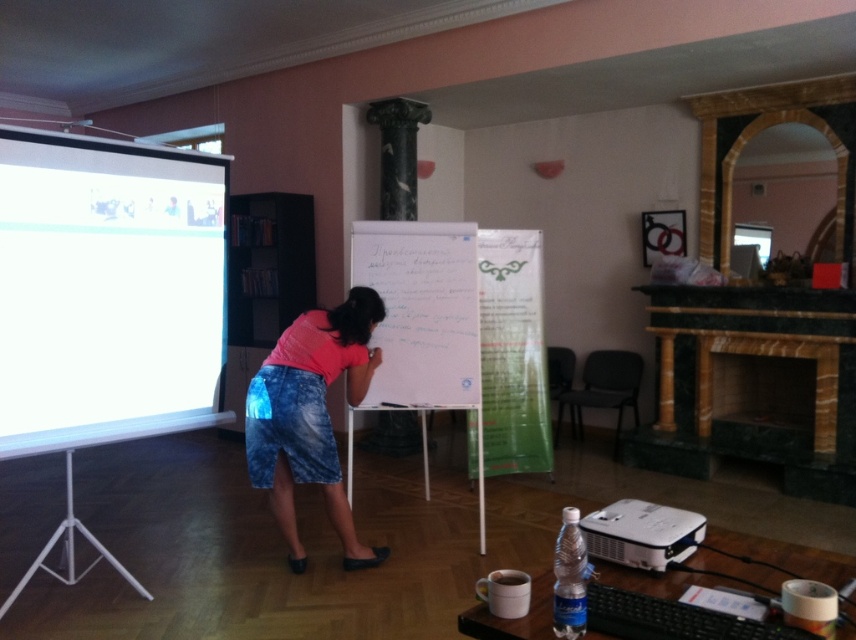
Question: Among these points, which one is nearest to the camera?

Choices:
 (A) [x=377, y=369]
 (B) [x=373, y=317]
 (C) [x=639, y=502]
 (D) [x=147, y=150]

Answer: (C)

Question: Based on their relative distances, which object is nearer to the pink fabric skirt at center?

Choices:
 (A) white plastic projector at lower right
 (B) white matte projection screen at left

Answer: (B)

Question: Does white matte projection screen at left have a greater width compared to pink fabric skirt at center?

Choices:
 (A) yes
 (B) no

Answer: (A)

Question: Does pink fabric skirt at center have a greater width compared to white plastic projector at lower right?

Choices:
 (A) no
 (B) yes

Answer: (B)

Question: Is white matte projection screen at left above white plastic projector at lower right?

Choices:
 (A) no
 (B) yes

Answer: (B)

Question: Based on their relative distances, which object is farther from the pink fabric skirt at center?

Choices:
 (A) white matte projection screen at left
 (B) whiteboard at center
 (C) white plastic projector at lower right

Answer: (C)